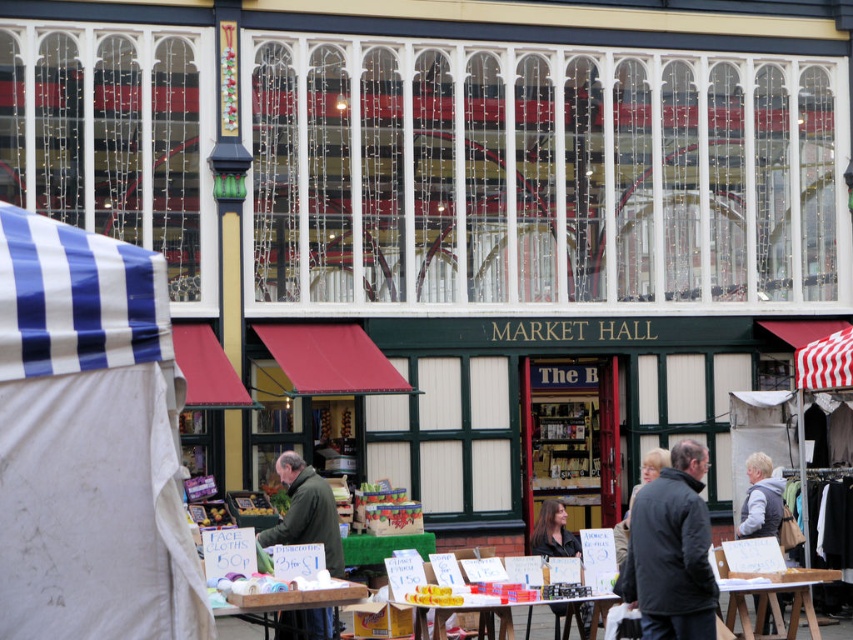
Who is positioned more to the left, wooden table at lower center or dark brown hair at center?

Positioned to the left is wooden table at lower center.

Between wooden table at lower center and dark brown hair at center, which one has less height?

wooden table at lower center is shorter.

Is point (254, 602) closer to camera compared to point (560, 508)?

Yes, it is.

Identify the location of wooden table at lower center. The height and width of the screenshot is (640, 853). (289, 602).

At what (x,y) coordinates should I click in order to perform the action: click on green matte jacket at center. Please return your answer as a coordinate pair (x, y). The image size is (853, 640). Looking at the image, I should click on (306, 512).

Between green matte jacket at center and dark brown hair at center, which one appears on the right side from the viewer's perspective?

dark brown hair at center is more to the right.

Locate an element on the screen. The image size is (853, 640). green matte jacket at center is located at coordinates (306, 512).

Locate an element on the screen. green matte jacket at center is located at coordinates (306, 512).

Is wooden table at lower center below translucent plastic table at center?

Actually, wooden table at lower center is above translucent plastic table at center.

Does point (250, 614) come behind point (479, 609)?

No, it is not.

Is point (241, 612) positioned in front of point (460, 620)?

That is True.

This screenshot has width=853, height=640. I want to click on wooden table at lower center, so click(x=289, y=602).